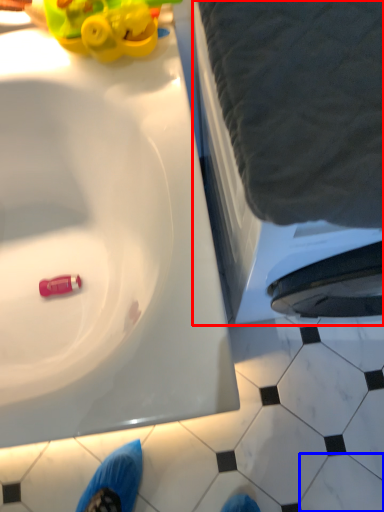
Question: Which of the following is the farthest to the observer, bath (highlighted by a red box) or tile (highlighted by a blue box)?

Choices:
 (A) bath
 (B) tile

Answer: (B)